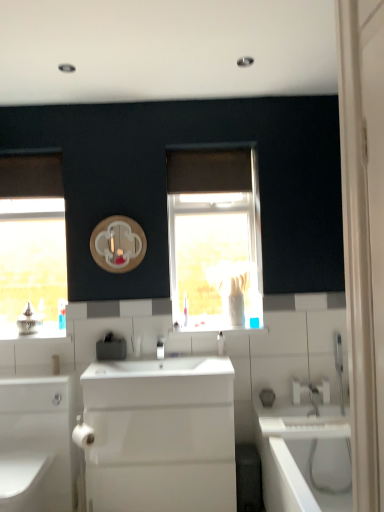
Question: From a real-world perspective, does wooden circle at center sit lower than satin black soap dispenser at center?

Choices:
 (A) no
 (B) yes

Answer: (A)

Question: Considering the relative positions of wooden circle at center and satin black soap dispenser at center in the image provided, is wooden circle at center to the right of satin black soap dispenser at center from the viewer's perspective?

Choices:
 (A) yes
 (B) no

Answer: (A)

Question: Considering the relative sizes of wooden circle at center and satin black soap dispenser at center in the image provided, is wooden circle at center wider than satin black soap dispenser at center?

Choices:
 (A) no
 (B) yes

Answer: (A)

Question: Is wooden circle at center shorter than satin black soap dispenser at center?

Choices:
 (A) no
 (B) yes

Answer: (A)

Question: Is the surface of wooden circle at center in direct contact with satin black soap dispenser at center?

Choices:
 (A) no
 (B) yes

Answer: (A)

Question: From a real-world perspective, is white glossy tap at center above or below white glossy soap dispenser at center?

Choices:
 (A) below
 (B) above

Answer: (A)

Question: Would you say white glossy tap at center is to the left or to the right of white glossy soap dispenser at center in the picture?

Choices:
 (A) left
 (B) right

Answer: (A)

Question: Relative to white glossy soap dispenser at center, is white glossy tap at center in front or behind?

Choices:
 (A) front
 (B) behind

Answer: (A)

Question: From the image's perspective, is white glossy tap at center positioned above or below white glossy soap dispenser at center?

Choices:
 (A) above
 (B) below

Answer: (B)

Question: From a real-world perspective, is white glossy soap dispenser at center positioned above or below white glossy tap at center?

Choices:
 (A) above
 (B) below

Answer: (A)

Question: From the image's perspective, is white glossy soap dispenser at center positioned above or below white glossy tap at center?

Choices:
 (A) above
 (B) below

Answer: (A)

Question: Considering the positions of point (220, 351) and point (160, 356), is point (220, 351) closer or farther from the camera than point (160, 356)?

Choices:
 (A) farther
 (B) closer

Answer: (A)

Question: In terms of width, does white glossy soap dispenser at center look wider or thinner when compared to white glossy tap at center?

Choices:
 (A) thin
 (B) wide

Answer: (A)

Question: From the image's perspective, is white glossy tap at center located above or below satin black soap dispenser at center?

Choices:
 (A) below
 (B) above

Answer: (B)

Question: In terms of size, does white glossy tap at center appear bigger or smaller than satin black soap dispenser at center?

Choices:
 (A) small
 (B) big

Answer: (A)